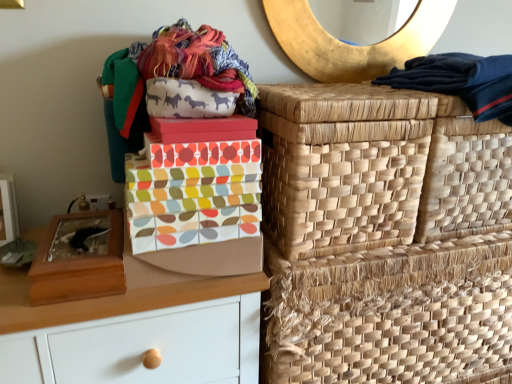
Question: Considering the relative sizes of dark blue fabric at upper right and multicolored fabric shoe box at center, the first shoe box viewed from the right, in the image provided, is dark blue fabric at upper right shorter than multicolored fabric shoe box at center, the first shoe box viewed from the right,?

Choices:
 (A) yes
 (B) no

Answer: (B)

Question: Is dark blue fabric at upper right looking in the opposite direction of multicolored fabric shoe box at center, which is the second shoe box from left to right?

Choices:
 (A) no
 (B) yes

Answer: (A)

Question: Would you say dark blue fabric at upper right is a long distance from multicolored fabric shoe box at center, which is the second shoe box from left to right?

Choices:
 (A) yes
 (B) no

Answer: (B)

Question: Is dark blue fabric at upper right outside of multicolored fabric shoe box at center, the first shoe box viewed from the right?

Choices:
 (A) no
 (B) yes

Answer: (B)

Question: Could multicolored fabric shoe box at center, the first shoe box viewed from the right, be considered to be inside dark blue fabric at upper right?

Choices:
 (A) no
 (B) yes

Answer: (A)

Question: Considering their positions, is matte brown chest of drawers at left located in front of or behind natural woven basket at upper right, marked as the 1th basket in a top-to-bottom arrangement?

Choices:
 (A) front
 (B) behind

Answer: (A)

Question: Does point (166, 362) appear closer or farther from the camera than point (503, 205)?

Choices:
 (A) farther
 (B) closer

Answer: (B)

Question: From their relative heights in the image, would you say matte brown chest of drawers at left is taller or shorter than natural woven basket at upper right, marked as the 1th basket in a top-to-bottom arrangement?

Choices:
 (A) tall
 (B) short

Answer: (A)

Question: In terms of width, does matte brown chest of drawers at left look wider or thinner when compared to natural woven basket at upper right, marked as the 1th basket in a top-to-bottom arrangement?

Choices:
 (A) thin
 (B) wide

Answer: (B)

Question: From a real-world perspective, relative to natural woven basket at right, the 1th basket ordered from the bottom, is natural woven basket at upper right, placed as the 3th basket when sorted from bottom to top, vertically above or below?

Choices:
 (A) above
 (B) below

Answer: (A)

Question: Looking at their shapes, would you say natural woven basket at upper right, marked as the 1th basket in a top-to-bottom arrangement, is wider or thinner than natural woven basket at right, the 1th basket ordered from the bottom?

Choices:
 (A) wide
 (B) thin

Answer: (B)

Question: Considering their positions, is natural woven basket at upper right, placed as the 3th basket when sorted from bottom to top, located in front of or behind natural woven basket at right, the 1th basket ordered from the bottom?

Choices:
 (A) behind
 (B) front

Answer: (A)

Question: Choose the correct answer: Is natural woven basket at upper right, placed as the 3th basket when sorted from bottom to top, inside natural woven basket at right, the 1th basket ordered from the bottom, or outside it?

Choices:
 (A) inside
 (B) outside

Answer: (B)

Question: In the image, is multicolored fabric shoe box at center, which is the second shoe box from left to right, on the left side or the right side of natural woven basket at right, which is counted as the second basket, starting from the top?

Choices:
 (A) left
 (B) right

Answer: (A)

Question: Is multicolored fabric shoe box at center, the first shoe box viewed from the right, spatially inside natural woven basket at right, which ranks as the second basket in bottom-to-top order, or outside of it?

Choices:
 (A) outside
 (B) inside

Answer: (A)